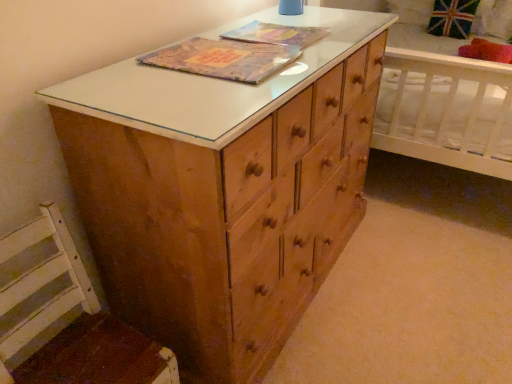
Question: Is the position of matte plastic book at center, which appears as the 1th book cover when viewed from the back, more distant than that of red plush pillow at upper right?

Choices:
 (A) yes
 (B) no

Answer: (B)

Question: Are matte plastic book at center, which appears as the 1th book cover when viewed from the back, and red plush pillow at upper right located far from each other?

Choices:
 (A) no
 (B) yes

Answer: (B)

Question: Does matte plastic book at center, which appears as the 1th book cover when viewed from the back, come in front of red plush pillow at upper right?

Choices:
 (A) yes
 (B) no

Answer: (A)

Question: Does matte plastic book at center, which appears as the 1th book cover when viewed from the back, have a greater height compared to red plush pillow at upper right?

Choices:
 (A) yes
 (B) no

Answer: (B)

Question: Is matte plastic book at center, which appears as the 1th book cover when viewed from the back, not inside red plush pillow at upper right?

Choices:
 (A) no
 (B) yes

Answer: (B)

Question: From the image's perspective, is textured paper book at center, the second book cover in the back-to-front sequence, above or below wooden swivel chair at lower left?

Choices:
 (A) below
 (B) above

Answer: (B)

Question: Is textured paper book at center, the second book cover in the back-to-front sequence, in front of or behind wooden swivel chair at lower left in the image?

Choices:
 (A) behind
 (B) front

Answer: (A)

Question: Considering the positions of textured paper book at center, the second book cover in the back-to-front sequence, and wooden swivel chair at lower left in the image, is textured paper book at center, the second book cover in the back-to-front sequence, wider or thinner than wooden swivel chair at lower left?

Choices:
 (A) thin
 (B) wide

Answer: (A)

Question: Is point (231, 56) closer or farther from the camera than point (39, 205)?

Choices:
 (A) farther
 (B) closer

Answer: (A)

Question: Is matte plastic book at center, the 2th book cover when ordered from front to back, inside the boundaries of textured paper book at center, which appears as the first book cover when viewed from the front, or outside?

Choices:
 (A) inside
 (B) outside

Answer: (B)

Question: Visually, is matte plastic book at center, which appears as the 1th book cover when viewed from the back, positioned to the left or to the right of textured paper book at center, the second book cover in the back-to-front sequence?

Choices:
 (A) left
 (B) right

Answer: (B)

Question: Is point (286, 24) positioned closer to the camera than point (221, 74)?

Choices:
 (A) closer
 (B) farther

Answer: (B)

Question: From the image's perspective, is matte plastic book at center, the 2th book cover when ordered from front to back, located above or below textured paper book at center, the second book cover in the back-to-front sequence?

Choices:
 (A) below
 (B) above

Answer: (B)

Question: Considering the positions of red plush pillow at upper right and wooden swivel chair at lower left in the image, is red plush pillow at upper right taller or shorter than wooden swivel chair at lower left?

Choices:
 (A) short
 (B) tall

Answer: (A)

Question: Considering their positions, is red plush pillow at upper right located in front of or behind wooden swivel chair at lower left?

Choices:
 (A) front
 (B) behind

Answer: (B)